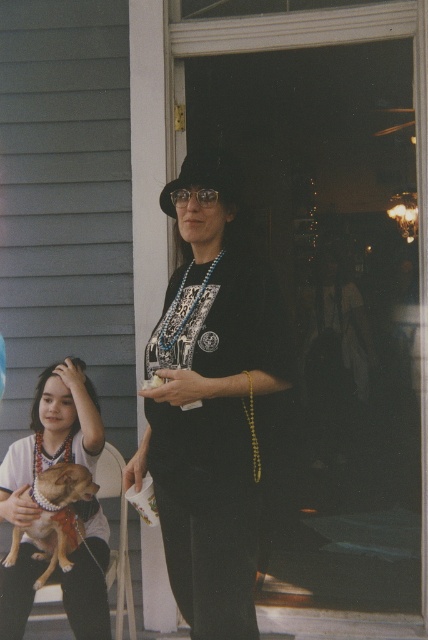
Question: From the image, what is the correct spatial relationship of black matte dress at center in relation to brown fur dog at lower left?

Choices:
 (A) above
 (B) below

Answer: (A)

Question: Which of the following is the farthest from the observer?

Choices:
 (A) brown fur dog at lower left
 (B) matte black dress at center

Answer: (A)

Question: Which point is farther from the camera taking this photo?

Choices:
 (A) (86, 499)
 (B) (95, 589)

Answer: (A)

Question: From the image, what is the correct spatial relationship of black matte dress at center in relation to brown fur dog at lower left?

Choices:
 (A) below
 (B) above

Answer: (B)

Question: Which object is the farthest from the black matte dress at center?

Choices:
 (A) matte black dress at center
 (B) brown fur dog at lower left

Answer: (A)

Question: Is matte black dress at center to the left of brown fur dog at lower left from the viewer's perspective?

Choices:
 (A) no
 (B) yes

Answer: (B)